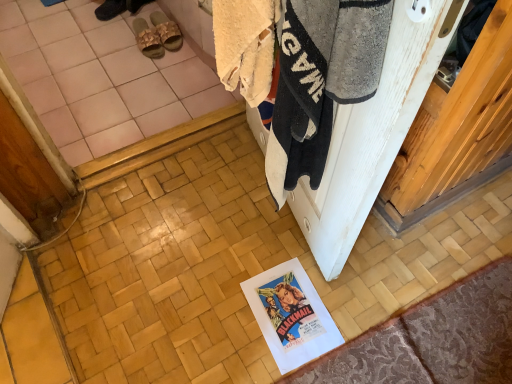
The image size is (512, 384). What do you see at coordinates (373, 132) in the screenshot? I see `white wood screen door at upper right` at bounding box center [373, 132].

This screenshot has width=512, height=384. What do you see at coordinates (291, 315) in the screenshot? I see `white paper at lower center` at bounding box center [291, 315].

At what (x,y) coordinates should I click in order to perform the action: click on patterned fabric doormat at lower right. Please return your answer as a coordinate pair (x, y). The height and width of the screenshot is (384, 512). Looking at the image, I should click on (432, 339).

Where is `dark brown leather sandals at upper center, which is the 1th footwear in left-to-right order`? dark brown leather sandals at upper center, which is the 1th footwear in left-to-right order is located at coordinates (110, 9).

At what (x,y) coordinates should I click in order to perform the action: click on beige woven slipper at upper left, acting as the third footwear starting from the left. Please return your answer as a coordinate pair (x, y). The image size is (512, 384). Looking at the image, I should click on (167, 31).

What is the approximate width of beige woven slipper at upper left, acting as the third footwear starting from the left?

beige woven slipper at upper left, acting as the third footwear starting from the left, is 11.23 inches wide.

The width and height of the screenshot is (512, 384). I want to click on white wood screen door at upper right, so click(x=373, y=132).

Is point (179, 47) closer to viewer compared to point (301, 270)?

That is False.

Who is shorter, beige woven slipper at upper left, the 1th footwear in the right-to-left sequence, or white paper at lower center?

white paper at lower center is shorter.

This screenshot has width=512, height=384. Find the location of `poster page directly beneath the beige woven slipper at upper left, acting as the third footwear starting from the left (from a real-world perspective)`. poster page directly beneath the beige woven slipper at upper left, acting as the third footwear starting from the left (from a real-world perspective) is located at coordinates (291, 315).

From a real-world perspective, who is located lower, beige woven slipper at upper left, acting as the third footwear starting from the left, or white paper at lower center?

white paper at lower center, from a real-world perspective.

Considering the positions of objects white fluffy towel at upper right and white wood screen door at upper right in the image provided, who is more to the left, white fluffy towel at upper right or white wood screen door at upper right?

white fluffy towel at upper right.

From their relative heights in the image, would you say white fluffy towel at upper right is taller or shorter than white wood screen door at upper right?

In the image, white fluffy towel at upper right appears to be shorter than white wood screen door at upper right.

Is white fluffy towel at upper right not close to white wood screen door at upper right?

A: They are positioned close to each other.

Is white paper at lower center far away from patterned fabric doormat at lower right?

No, white paper at lower center is not far away from patterned fabric doormat at lower right.

In the scene shown: Can we say white paper at lower center lies outside patterned fabric doormat at lower right?

Indeed, white paper at lower center is completely outside patterned fabric doormat at lower right.

Between white paper at lower center and patterned fabric doormat at lower right, which one has less height?

white paper at lower center is shorter.

Which point is more forward, (268, 305) or (492, 276)?

Positioned in front is point (268, 305).

Which is behind, white paper at lower center or dark brown leather sandals at upper center, positioned as the 3th footwear in right-to-left order?

dark brown leather sandals at upper center, positioned as the 3th footwear in right-to-left order, is further from the camera.

Would you say white paper at lower center is a long distance from dark brown leather sandals at upper center, which is the 1th footwear in left-to-right order?

white paper at lower center is far away from dark brown leather sandals at upper center, which is the 1th footwear in left-to-right order.

Looking at their sizes, would you say white paper at lower center is wider or thinner than dark brown leather sandals at upper center, which is the 1th footwear in left-to-right order?

Considering their sizes, white paper at lower center looks broader than dark brown leather sandals at upper center, which is the 1th footwear in left-to-right order.

Locate an element on the screen. This screenshot has width=512, height=384. the 1st footwear behind when counting from the white paper at lower center is located at coordinates (148, 39).

Are beige fabric slipper at upper left, which ranks as the second footwear in right-to-left order, and white paper at lower center making contact?

No, beige fabric slipper at upper left, which ranks as the second footwear in right-to-left order, is not in contact with white paper at lower center.

Consider the image. From a real-world perspective, which object rests below the other?

white paper at lower center, from a real-world perspective.

From the image's perspective, is patterned fabric doormat at lower right above or below white paper at lower center?

Clearly, from the image's perspective, patterned fabric doormat at lower right is below white paper at lower center.

From a real-world perspective, is patterned fabric doormat at lower right on top of white paper at lower center?

Yes.

Who is taller, patterned fabric doormat at lower right or white paper at lower center?

patterned fabric doormat at lower right is taller.

Is patterned fabric doormat at lower right outside of white paper at lower center?

Indeed, patterned fabric doormat at lower right is completely outside white paper at lower center.

From the image's perspective, is white paper at lower center located above beige fabric slipper at upper left, which ranks as the second footwear in right-to-left order?

Actually, white paper at lower center appears below beige fabric slipper at upper left, which ranks as the second footwear in right-to-left order, in the image.

From a real-world perspective, between white paper at lower center and beige fabric slipper at upper left, which ranks as the second footwear in right-to-left order, who is vertically lower?

From a 3D spatial view, white paper at lower center is below.

Looking at this image, which of these two, white paper at lower center or beige fabric slipper at upper left, which is counted as the second footwear, starting from the left, is smaller?

white paper at lower center.

What are the coordinates of `footwear that is the 2nd object located behind the white paper at lower center` in the screenshot? It's located at (167, 31).

Locate an element on the screen. This screenshot has width=512, height=384. screen door located on the right of white fluffy towel at upper right is located at coordinates (373, 132).

Looking at the image, which one is located further to beige fabric slipper at upper left, which ranks as the second footwear in right-to-left order, patterned fabric doormat at lower right or white wood screen door at upper right?

patterned fabric doormat at lower right is further to beige fabric slipper at upper left, which ranks as the second footwear in right-to-left order.

Considering their positions, is patterned fabric doormat at lower right positioned closer to dark brown leather sandals at upper center, which is the 1th footwear in left-to-right order, than beige woven slipper at upper left, acting as the third footwear starting from the left?

beige woven slipper at upper left, acting as the third footwear starting from the left.

From the image, which object appears to be nearer to white wood screen door at upper right, dark brown leather sandals at upper center, which is the 1th footwear in left-to-right order, or patterned fabric doormat at lower right?

patterned fabric doormat at lower right is positioned closer to the anchor white wood screen door at upper right.

Estimate the real-world distances between objects in this image. Which object is further from patterned fabric doormat at lower right, beige fabric slipper at upper left, which is counted as the second footwear, starting from the left, or white fluffy towel at upper right?

beige fabric slipper at upper left, which is counted as the second footwear, starting from the left, is positioned further to the anchor patterned fabric doormat at lower right.

Estimate the real-world distances between objects in this image. Which object is closer to beige woven slipper at upper left, the 1th footwear in the right-to-left sequence, patterned fabric doormat at lower right or white paper at lower center?

white paper at lower center lies closer to beige woven slipper at upper left, the 1th footwear in the right-to-left sequence, than the other object.

Considering their positions, is dark brown leather sandals at upper center, which is the 1th footwear in left-to-right order, positioned closer to patterned fabric doormat at lower right than white wood screen door at upper right?

white wood screen door at upper right is closer to patterned fabric doormat at lower right.

Which object lies nearer to the anchor point beige fabric slipper at upper left, which is counted as the second footwear, starting from the left, dark brown leather sandals at upper center, positioned as the 3th footwear in right-to-left order, or white wood screen door at upper right?

Based on the image, dark brown leather sandals at upper center, positioned as the 3th footwear in right-to-left order, appears to be nearer to beige fabric slipper at upper left, which is counted as the second footwear, starting from the left.

Looking at the image, which one is located further to beige woven slipper at upper left, acting as the third footwear starting from the left, white paper at lower center or dark brown leather sandals at upper center, positioned as the 3th footwear in right-to-left order?

white paper at lower center is positioned further to the anchor beige woven slipper at upper left, acting as the third footwear starting from the left.

This screenshot has height=384, width=512. Identify the location of footwear that lies between beige woven slipper at upper left, the 1th footwear in the right-to-left sequence, and patterned fabric doormat at lower right from top to bottom. (x=148, y=39).

You are a GUI agent. You are given a task and a screenshot of the screen. Output one action in this format:
    pyautogui.click(x=<x>, y=<y>)
    Task: Click on the poster page positioned between white fluffy towel at upper right and beige woven slipper at upper left, acting as the third footwear starting from the left, from near to far
    The height and width of the screenshot is (384, 512).
    Given the screenshot: What is the action you would take?
    pyautogui.click(x=291, y=315)

In order to click on poster page positioned between white wood screen door at upper right and dark brown leather sandals at upper center, positioned as the 3th footwear in right-to-left order, from near to far in this screenshot , I will do `click(291, 315)`.

Find the location of a particular element. The image size is (512, 384). poster page located between white fluffy towel at upper right and dark brown leather sandals at upper center, positioned as the 3th footwear in right-to-left order, in the depth direction is located at coordinates (291, 315).